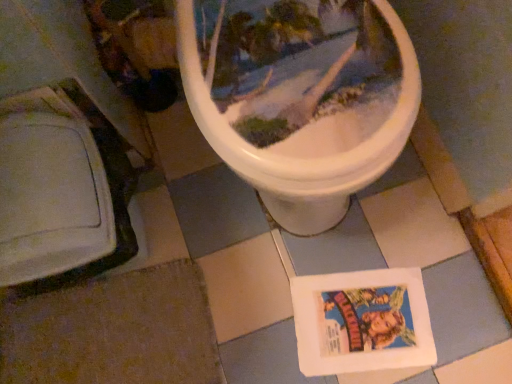
This screenshot has height=384, width=512. What are the coordinates of `brown fabric at lower left` in the screenshot? It's located at (114, 332).

What is the approximate width of brown fabric at lower left?

It is 50.03 centimeters.

This screenshot has width=512, height=384. What do you see at coordinates (114, 332) in the screenshot?
I see `brown fabric at lower left` at bounding box center [114, 332].

Identify the location of white paper comic book at lower center. The width and height of the screenshot is (512, 384). (362, 321).

The image size is (512, 384). What do you see at coordinates (362, 321) in the screenshot? I see `white paper comic book at lower center` at bounding box center [362, 321].

Measure the distance between point (390, 338) and camera.

The distance of point (390, 338) from camera is 36.54 inches.

Find the location of a particular element. Image resolution: width=512 pixels, height=384 pixels. brown fabric at lower left is located at coordinates (114, 332).

In the scene shown: Which object is positioned more to the left, white paper comic book at lower center or brown fabric at lower left?

brown fabric at lower left is more to the left.

Which object is closer to the camera, white paper comic book at lower center or brown fabric at lower left?

Positioned in front is brown fabric at lower left.

Considering the positions of point (338, 303) and point (48, 348), is point (338, 303) closer or farther from the camera than point (48, 348)?

Clearly, point (338, 303) is more distant from the camera than point (48, 348).

From the image's perspective, is white paper comic book at lower center on brown fabric at lower left?

Yes.

From a real-world perspective, between white paper comic book at lower center and brown fabric at lower left, who is vertically lower?

white paper comic book at lower center is physically lower.

Considering the sizes of white paper comic book at lower center and brown fabric at lower left in the image, is white paper comic book at lower center wider or thinner than brown fabric at lower left?

Considering their sizes, white paper comic book at lower center looks slimmer than brown fabric at lower left.

Is white paper comic book at lower center taller or shorter than brown fabric at lower left?

Considering their sizes, white paper comic book at lower center has less height than brown fabric at lower left.

Is white paper comic book at lower center bigger than brown fabric at lower left?

No.

Is white paper comic book at lower center inside the boundaries of brown fabric at lower left, or outside?

white paper comic book at lower center exists outside the volume of brown fabric at lower left.

Would you say white paper comic book at lower center is a long distance from brown fabric at lower left?

white paper comic book at lower center is actually quite close to brown fabric at lower left.

Is white paper comic book at lower center facing towards brown fabric at lower left?

Yes, white paper comic book at lower center is facing brown fabric at lower left.

Can you tell me how much white paper comic book at lower center and brown fabric at lower left differ in facing direction?

There is a 167-degree angle between the facing directions of white paper comic book at lower center and brown fabric at lower left.

I want to click on tile in front of the white paper comic book at lower center, so click(x=114, y=332).

Which is more to the right, brown fabric at lower left or white paper comic book at lower center?

Positioned to the right is white paper comic book at lower center.

Considering the positions of objects brown fabric at lower left and white paper comic book at lower center in the image provided, who is behind, brown fabric at lower left or white paper comic book at lower center?

white paper comic book at lower center is more distant.

Which is behind, point (127, 281) or point (391, 305)?

The point (127, 281) is more distant.

From the image's perspective, is brown fabric at lower left on white paper comic book at lower center?

No, from the image's perspective, brown fabric at lower left is not on top of white paper comic book at lower center.

From a real-world perspective, is brown fabric at lower left on top of white paper comic book at lower center?

Yes, from a real-world perspective, brown fabric at lower left is above white paper comic book at lower center.

Considering the sizes of objects brown fabric at lower left and white paper comic book at lower center in the image provided, who is thinner, brown fabric at lower left or white paper comic book at lower center?

white paper comic book at lower center is thinner.

Does brown fabric at lower left have a lesser height compared to white paper comic book at lower center?

No.

Between brown fabric at lower left and white paper comic book at lower center, which one has smaller size?

white paper comic book at lower center.

Choose the correct answer: Is brown fabric at lower left inside white paper comic book at lower center or outside it?

brown fabric at lower left is spatially situated outside white paper comic book at lower center.

Would you consider brown fabric at lower left to be distant from white paper comic book at lower center?

brown fabric at lower left is actually quite close to white paper comic book at lower center.

Is white paper comic book at lower center at the back of brown fabric at lower left?

No, brown fabric at lower left is not facing away from white paper comic book at lower center.

How different are the orientations of brown fabric at lower left and white paper comic book at lower center in degrees?

There is a 167-degree angle between the facing directions of brown fabric at lower left and white paper comic book at lower center.

Measure the distance from brown fabric at lower left to white paper comic book at lower center.

14.69 inches.

This screenshot has width=512, height=384. I want to click on comic book that appears on the right of brown fabric at lower left, so click(362, 321).

Where is `tile above the white paper comic book at lower center (from a real-world perspective)`? tile above the white paper comic book at lower center (from a real-world perspective) is located at coordinates (114, 332).

Image resolution: width=512 pixels, height=384 pixels. I want to click on comic book to the right of brown fabric at lower left, so click(362, 321).